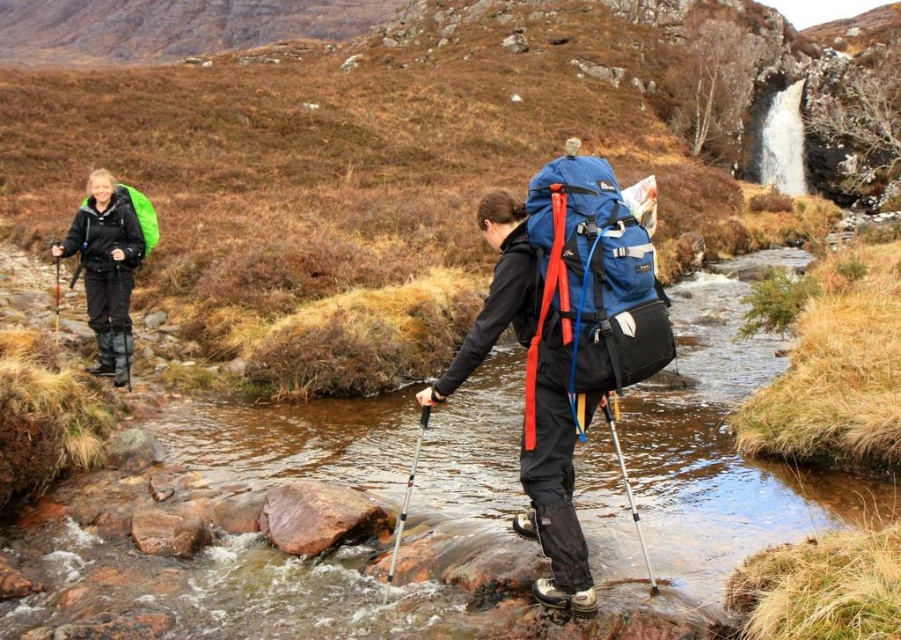
Question: Which object appears farthest from the camera in this image?

Choices:
 (A) matte black jacket at left
 (B) green matte backpack at left
 (C) brown rocky creek at center
 (D) blue fabric backpack at center

Answer: (B)

Question: Which point appears closest to the camera in this image?

Choices:
 (A) pos(153,234)
 (B) pos(731,364)

Answer: (A)

Question: Is brown rocky creek at center positioned before matte blue backpack at center?

Choices:
 (A) yes
 (B) no

Answer: (A)

Question: Is brown rocky creek at center wider than green matte backpack at left?

Choices:
 (A) no
 (B) yes

Answer: (B)

Question: Considering the real-world distances, which object is closest to the matte black jacket at left?

Choices:
 (A) matte blue backpack at center
 (B) brown rocky creek at center
 (C) green matte backpack at left
 (D) blue fabric backpack at center

Answer: (C)

Question: Does brown rocky creek at center appear on the right side of matte blue backpack at center?

Choices:
 (A) no
 (B) yes

Answer: (A)